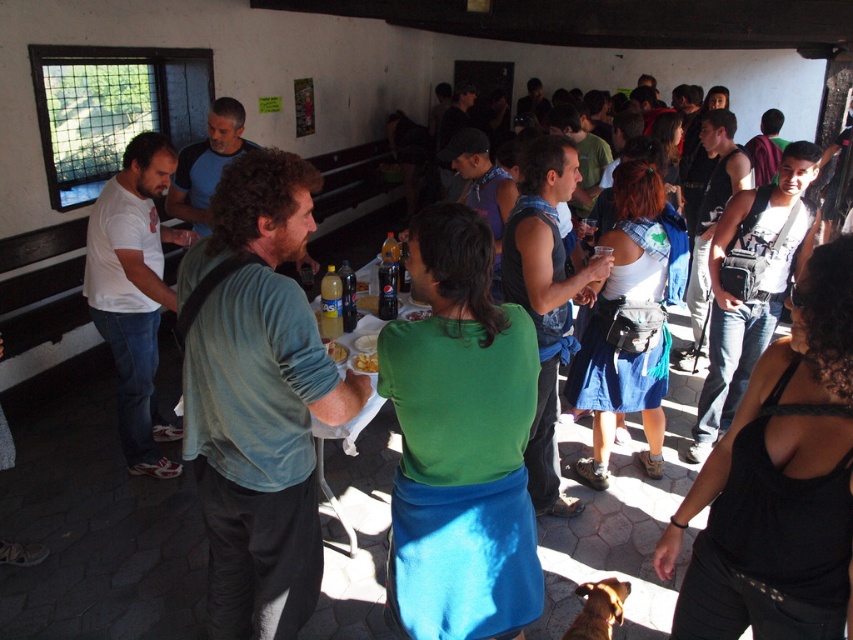
Question: Does brown furry dog at lower center appear over yellow matte plate at center?

Choices:
 (A) no
 (B) yes

Answer: (A)

Question: Does white cotton shirt at left have a smaller size compared to yellow matte plate at center?

Choices:
 (A) yes
 (B) no

Answer: (B)

Question: Which point is closer to the camera taking this photo?

Choices:
 (A) (357, 358)
 (B) (339, 352)
 (C) (590, 632)
 (D) (120, 268)

Answer: (C)

Question: Which object is closer to the camera taking this photo?

Choices:
 (A) white cotton shirt at left
 (B) yellow matte snack at center

Answer: (B)

Question: Is yellow matte snack at center below yellow matte plate at center?

Choices:
 (A) no
 (B) yes

Answer: (B)

Question: Which point appears closest to the camera in this image?

Choices:
 (A) (x=328, y=349)
 (B) (x=375, y=362)

Answer: (B)